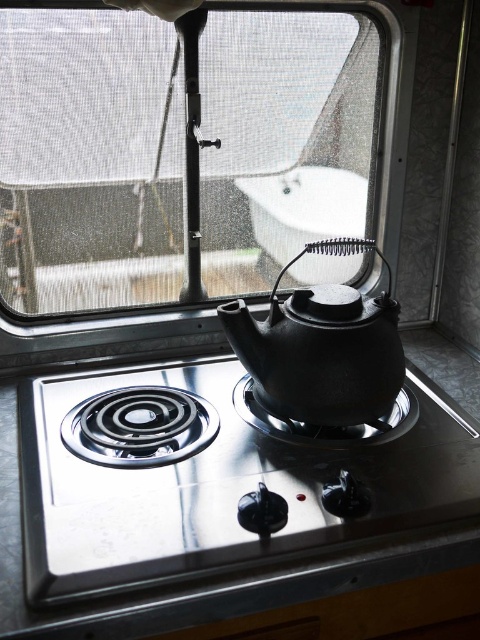
Is transparent mesh at upper center wider than black cast iron teapot at center?

Yes.

Is transparent mesh at upper center behind black cast iron teapot at center?

That is True.

Which is in front, point (132, 202) or point (336, 321)?

Positioned in front is point (336, 321).

Locate an element on the screen. This screenshot has width=480, height=640. transparent mesh at upper center is located at coordinates (88, 161).

Identify the location of transparent mesh at upper center. The image size is (480, 640). (88, 161).

Between transparent mesh at upper center and satin silver gas stove at center, which one is positioned lower?

satin silver gas stove at center is below.

Describe the element at coordinates (88, 161) in the screenshot. I see `transparent mesh at upper center` at that location.

You are a GUI agent. You are given a task and a screenshot of the screen. Output one action in this format:
    pyautogui.click(x=<x>, y=<y>)
    Task: Click on the transparent mesh at upper center
    This screenshot has width=480, height=640.
    Given the screenshot: What is the action you would take?
    pyautogui.click(x=88, y=161)

Is satin silver gas stove at center positioned behind black cast iron teapot at center?

No, it is in front of black cast iron teapot at center.

Is point (23, 422) farther from camera compared to point (372, 324)?

Yes, it is.

Locate an element on the screen. satin silver gas stove at center is located at coordinates (217, 486).